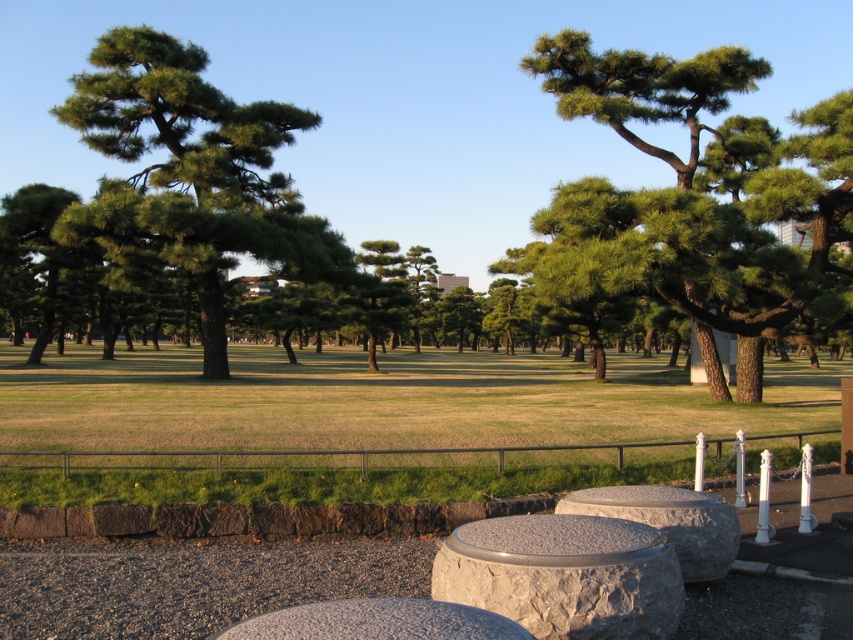
You are standing at the edge of the grassy area in the park and want to place a picnic blanket between the green textured tree at center and the green matte tree at center. What is the minimum distance you need to walk from the edge to reach the spot between them?

The green textured tree at center is 10.40 meters away from the green matte tree at center. To place the picnic blanket between them, you need to walk at least half of that distance, which is 5.20 meters, from the edge to reach the midpoint between them.